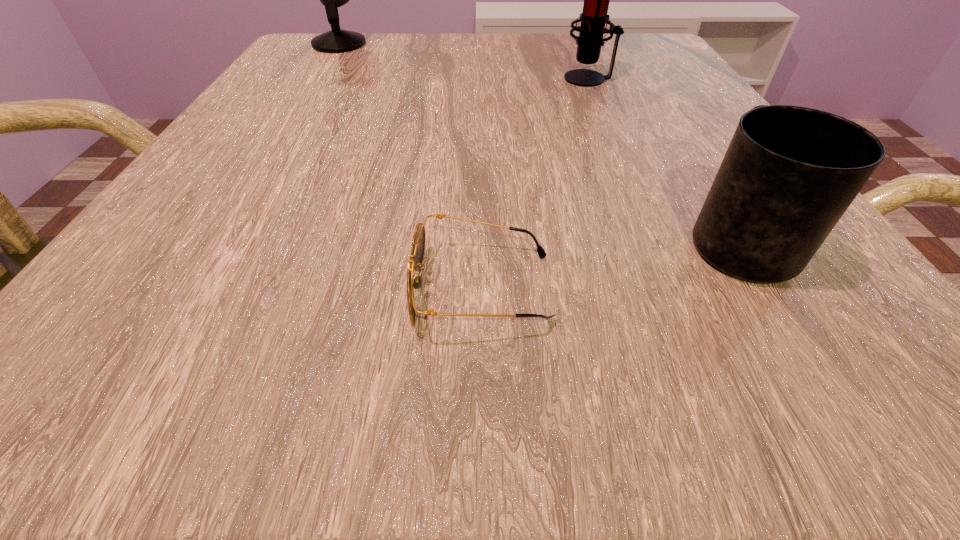
Find the location of a particular element. The width and height of the screenshot is (960, 540). free space that satisfies the following two spatial constraints: 1. on the stand of the farthest object; 2. on the side of the third tallest object with the handle is located at coordinates (216, 239).

Find the location of a particular element. vacant region that satisfies the following two spatial constraints: 1. on the stand of the nearer microphone; 2. on the left side of the leftmost object is located at coordinates (317, 78).

Where is `free location that satisfies the following two spatial constraints: 1. on the stand of the farther microphone; 2. on the back side of the third nearest object`? free location that satisfies the following two spatial constraints: 1. on the stand of the farther microphone; 2. on the back side of the third nearest object is located at coordinates (317, 78).

You are a GUI agent. You are given a task and a screenshot of the screen. Output one action in this format:
    pyautogui.click(x=<x>, y=<y>)
    Task: Click on the free spot that satisfies the following two spatial constraints: 1. on the side of the mug with the handle; 2. on the stand of the leftmost object
    The image size is (960, 540).
    Given the screenshot: What is the action you would take?
    pyautogui.click(x=617, y=44)